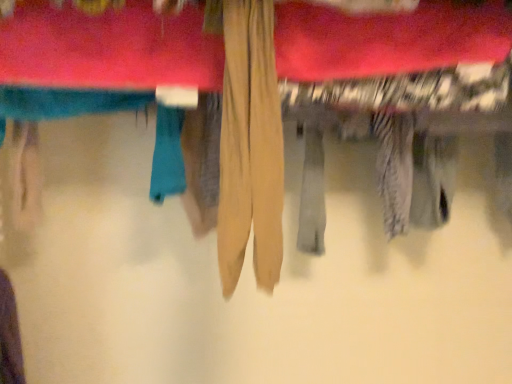
Question: Is point (302, 74) positioned closer to the camera than point (258, 94)?

Choices:
 (A) farther
 (B) closer

Answer: (A)

Question: Relative to tan fabric pants at center, is beige fabric towel at center in front or behind?

Choices:
 (A) behind
 (B) front

Answer: (A)

Question: In terms of width, does beige fabric towel at center look wider or thinner when compared to tan fabric pants at center?

Choices:
 (A) thin
 (B) wide

Answer: (A)

Question: Relative to beige fabric towel at center, is tan fabric pants at center in front or behind?

Choices:
 (A) front
 (B) behind

Answer: (A)

Question: From a real-world perspective, is tan fabric pants at center positioned above or below beige fabric towel at center?

Choices:
 (A) above
 (B) below

Answer: (B)

Question: Is point [225, 248] closer or farther from the camera than point [95, 26]?

Choices:
 (A) farther
 (B) closer

Answer: (B)

Question: In terms of size, does tan fabric pants at center appear bigger or smaller than beige fabric towel at center?

Choices:
 (A) small
 (B) big

Answer: (A)